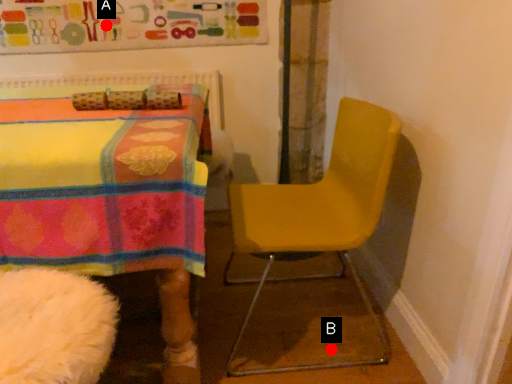
Question: Two points are circled on the image, labeled by A and B beside each circle. Which point appears farthest from the camera in this image?

Choices:
 (A) A is further
 (B) B is further

Answer: (A)